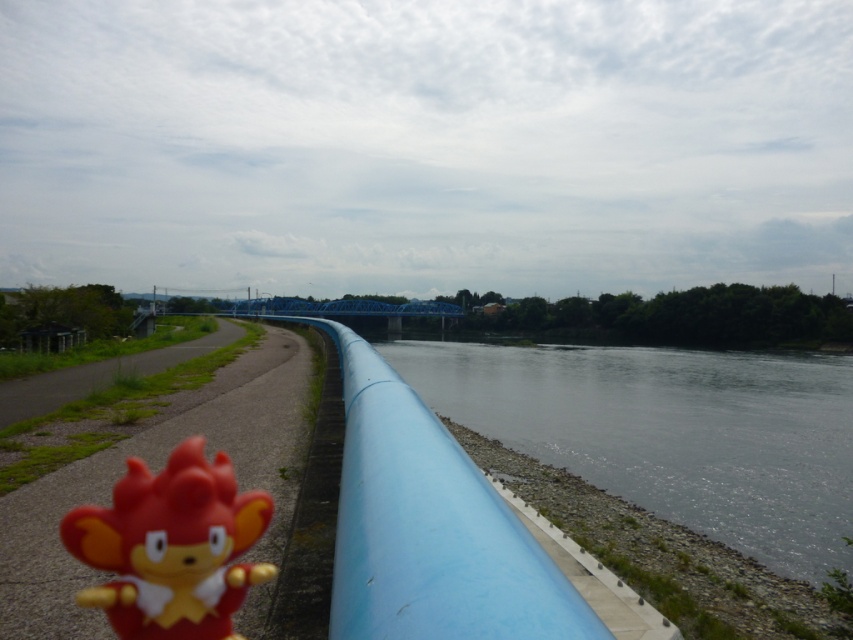
Is blue smooth pipe at lower center taller than rubber toy at lower left?

Indeed, blue smooth pipe at lower center has a greater height compared to rubber toy at lower left.

Based on the photo, is blue smooth pipe at lower center bigger than rubber toy at lower left?

Yes.

Is point (814, 536) positioned behind point (123, 552)?

Yes, it is behind point (123, 552).

Where is `blue smooth pipe at lower center`? The height and width of the screenshot is (640, 853). blue smooth pipe at lower center is located at coordinates (670, 433).